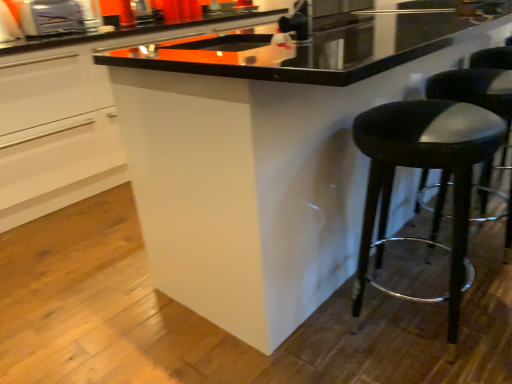
Identify the location of free space above black leather stool at right (from a real-world perspective). Image resolution: width=512 pixels, height=384 pixels. (476, 75).